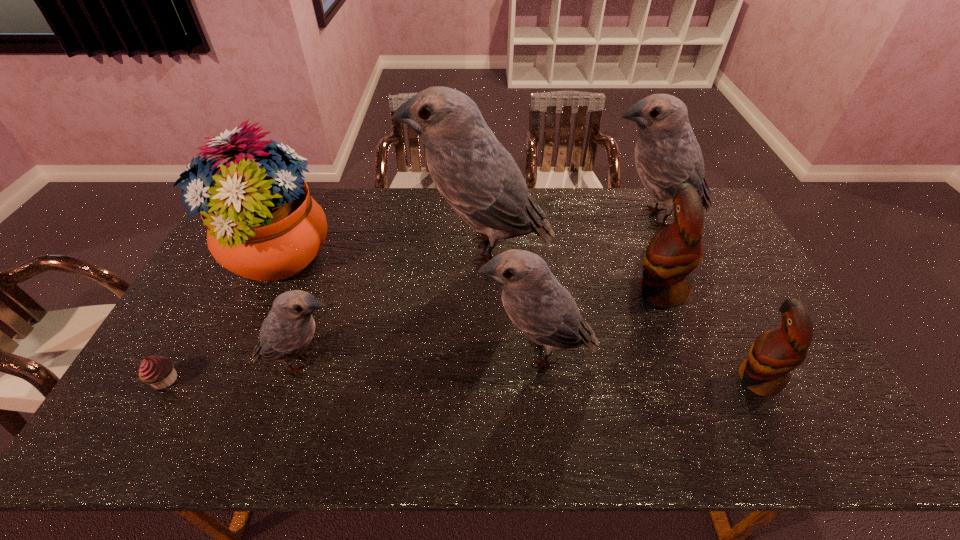
The width and height of the screenshot is (960, 540). Find the location of `free location located on the face of the right red parrot`. free location located on the face of the right red parrot is located at coordinates (614, 379).

Locate an element on the screen. vacant space located 0.060m on the back of the cupcake is located at coordinates (182, 348).

What are the coordinates of `parrot located in the far edge section of the desktop` in the screenshot? It's located at (667, 154).

The height and width of the screenshot is (540, 960). Identify the location of flower arrangement located at the far edge. (263, 225).

You are a GUI agent. You are given a task and a screenshot of the screen. Output one action in this format:
    pyautogui.click(x=<x>, y=<y>)
    Task: Click on the flower arrangement that is at the left edge
    
    Given the screenshot: What is the action you would take?
    pyautogui.click(x=263, y=225)

Find the location of a particular element. cupcake located at the left edge is located at coordinates click(158, 371).

At what (x,y) coordinates should I click in order to perform the action: click on object at the far left corner. Please return your answer as a coordinate pair (x, y). Looking at the image, I should click on (263, 225).

Find the location of `object that is positioned at the far right corner`. object that is positioned at the far right corner is located at coordinates (667, 154).

Find the location of a particular element. vacant region at the near edge of the desktop is located at coordinates (485, 415).

Find the location of `vacant space at the left edge of the desktop`. vacant space at the left edge of the desktop is located at coordinates (224, 329).